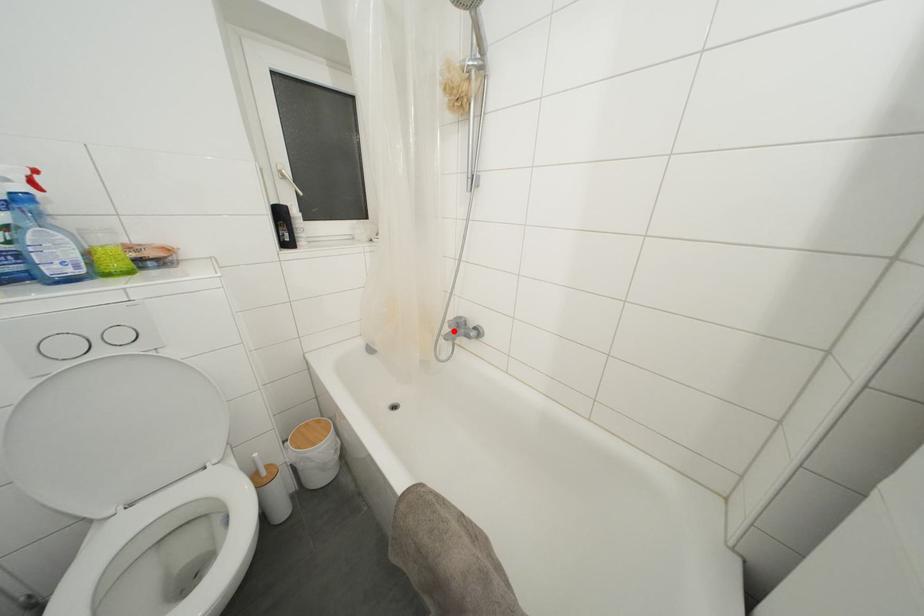
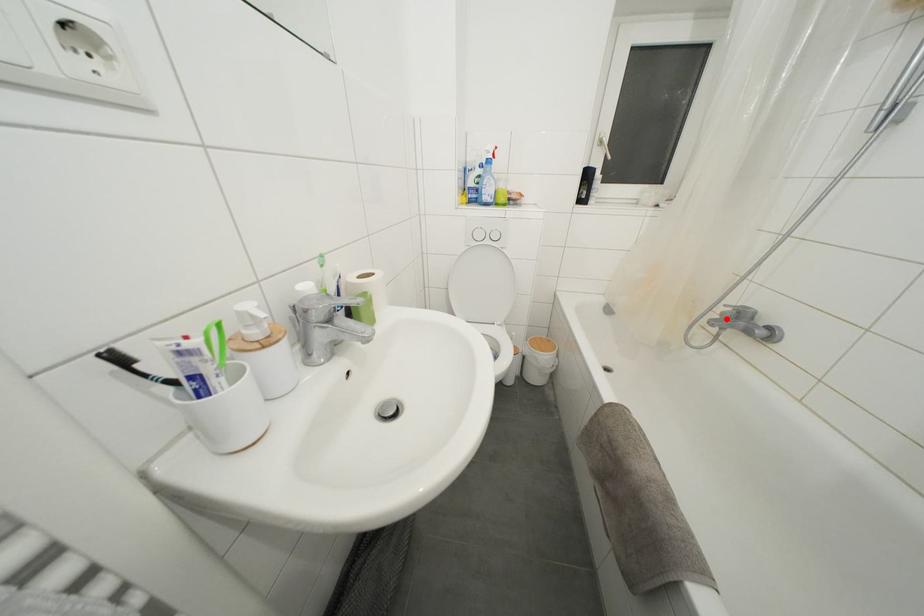
I am providing you with two images of the same scene from different viewpoints. A red point is marked on the first image and another point is marked on the second image. Do the highlighted points in image1 and image2 indicate the same real-world spot?

Yes